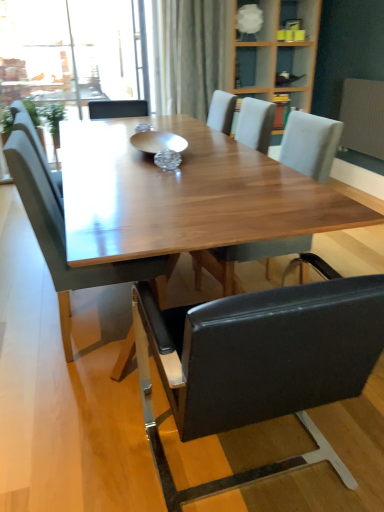
At what (x,y) coordinates should I click in order to perform the action: click on free space in front of matte gray chair at left, which appears as the 3th chair when viewed from the right. Please return your answer as a coordinate pair (x, y). This screenshot has height=512, width=384. Looking at the image, I should click on (74, 412).